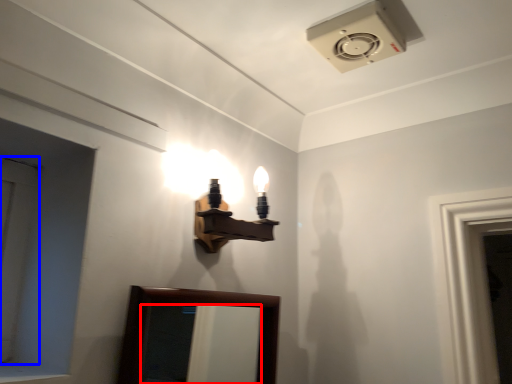
Question: Which object appears closest to the camera in this image, mirror (highlighted by a red box) or door (highlighted by a blue box)?

Choices:
 (A) mirror
 (B) door

Answer: (B)